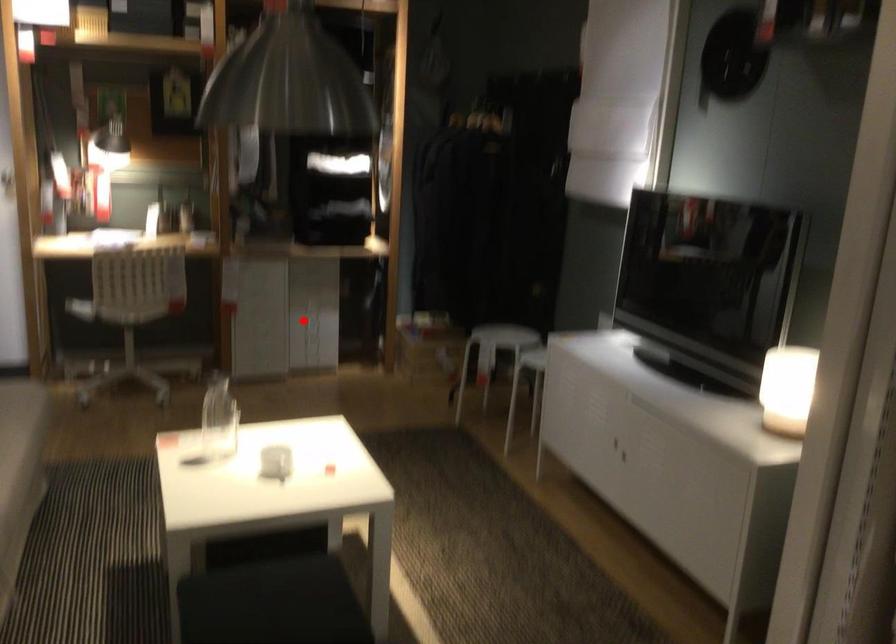
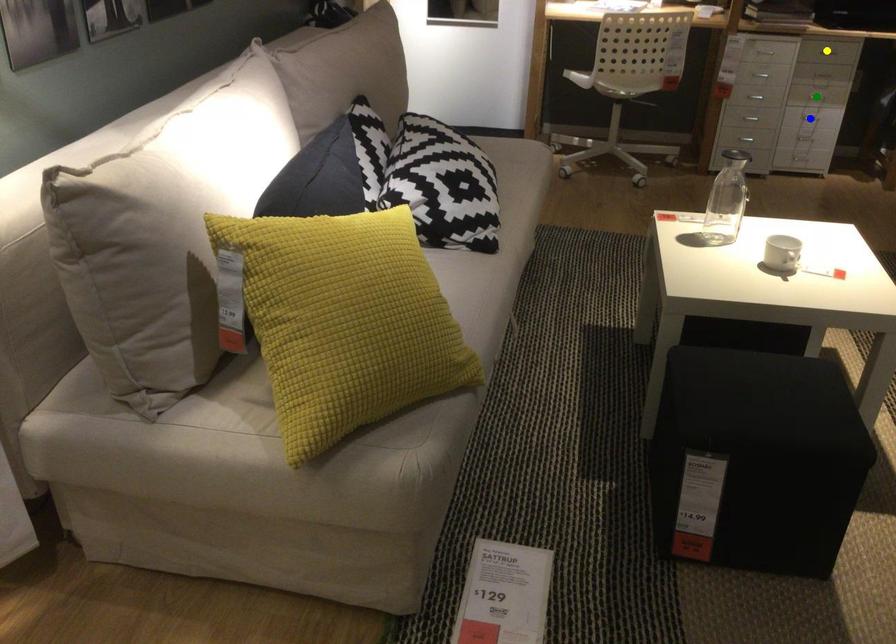
Question: I am providing you with two images of the same scene from different viewpoints. A red point is marked on the first image. You are given multiple points on the second image. Can you choose the point in image 2 that corresponds to the point in image 1?

Choices:
 (A) blue point
 (B) green point
 (C) yellow point

Answer: (B)